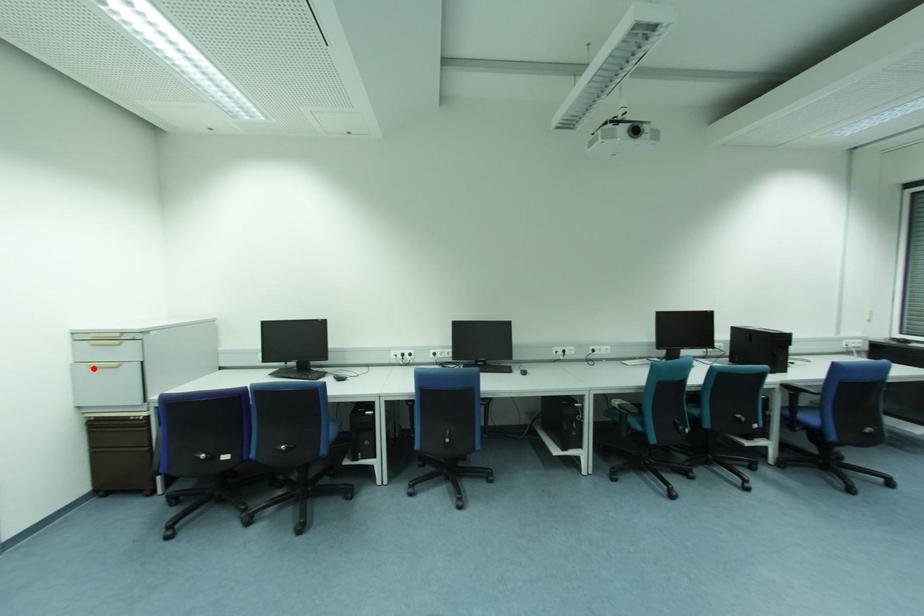
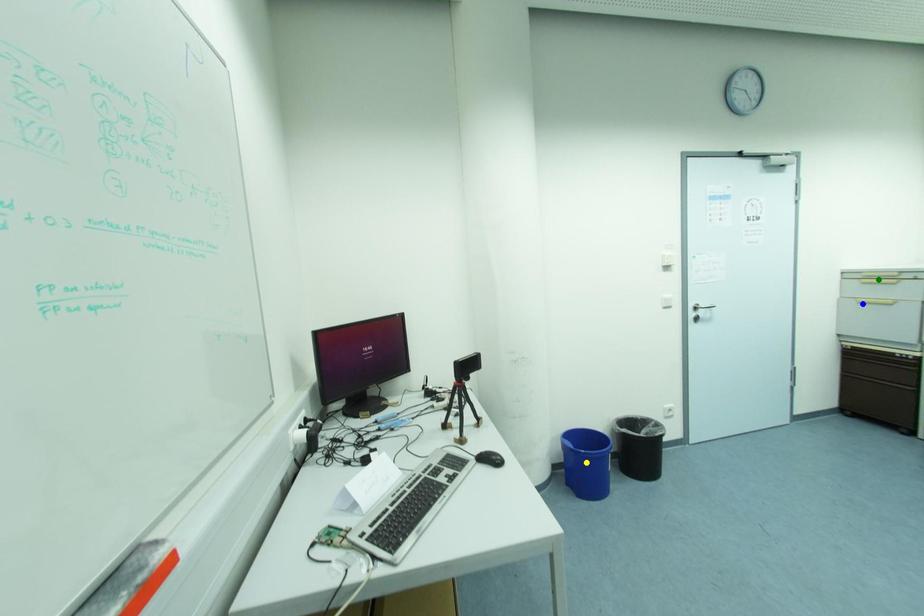
Question: I am providing you with two images of the same scene from different viewpoints. A red point is marked on the first image. You are given multiple points on the second image. Which point in image 2 represents the same 3d spot as the red point in image 1?

Choices:
 (A) yellow point
 (B) blue point
 (C) green point

Answer: (B)